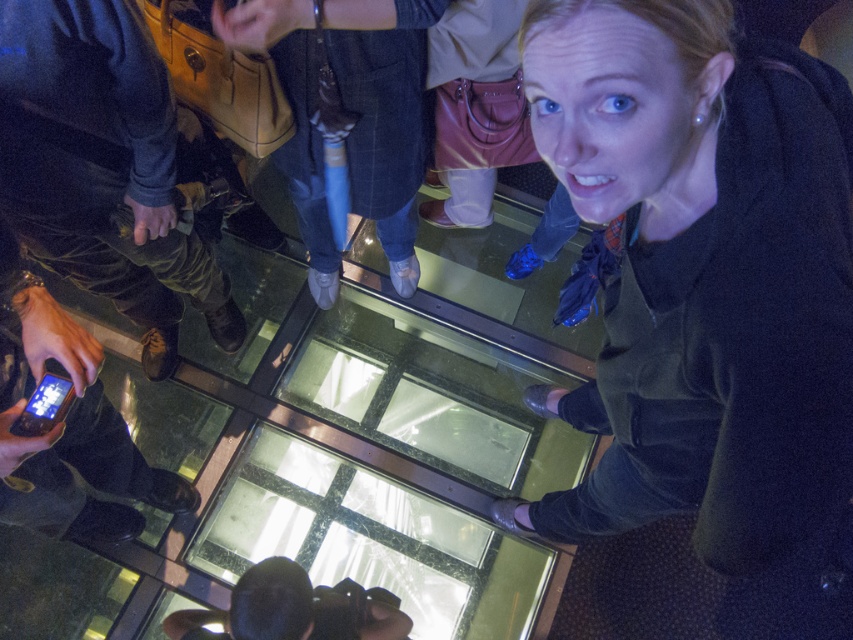
You are standing at the origin point in the image. There is a velvet black sweater at upper right represented by point [705,284]. Can you walk directly towards the velvet black sweater at upper right without stepping on any glass panels?

The velvet black sweater at upper right is represented by point [705,284], but there is no information provided about the glass panels layout or their positions relative to the sweater. Therefore, it is impossible to determine if you can walk directly towards the velvet black sweater at upper right without stepping on any glass panels.

You are a fashion designer observing the glass floor scene. You need to determine which clothing item is positioned higher in the image for a photo shoot. Which one is taller between the velvet black sweater at upper right and the camouflage pants at left?

The velvet black sweater at upper right is much taller than the camouflage pants at left, so it is positioned higher in the image.

You are a photographer trying to capture a clear shot of the glass floor pattern. You notice the velvet black sweater at upper right and the camouflage pants at left. Which object is closer to the camera, making it appear in front?

The velvet black sweater at upper right is in front of the camouflage pants at left, so it is closer to the camera.